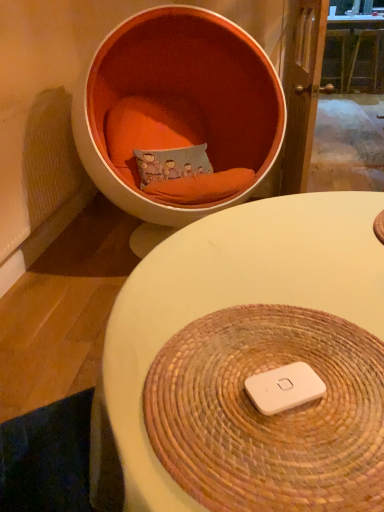
This screenshot has height=512, width=384. I want to click on vacant area on the back side of white matte/ipod at center, so click(267, 329).